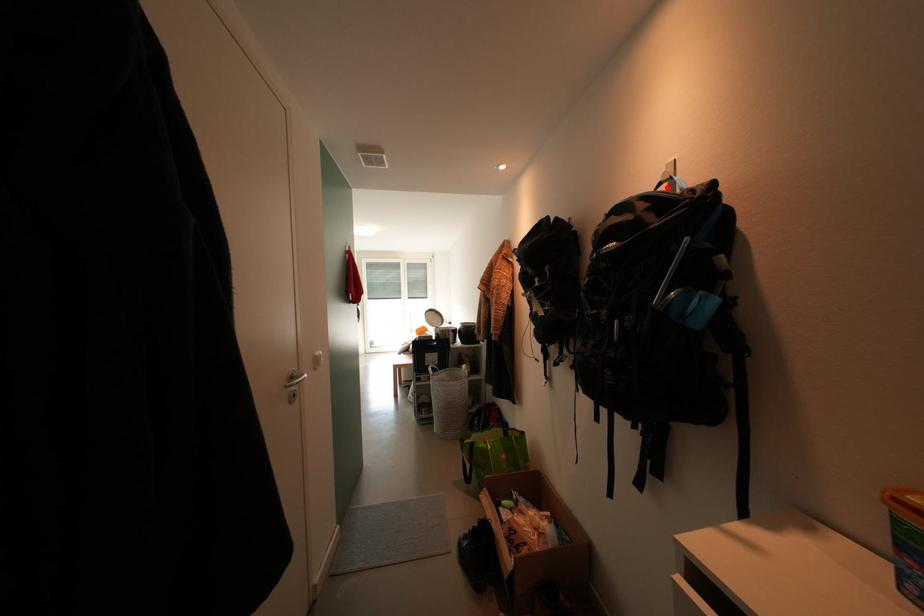
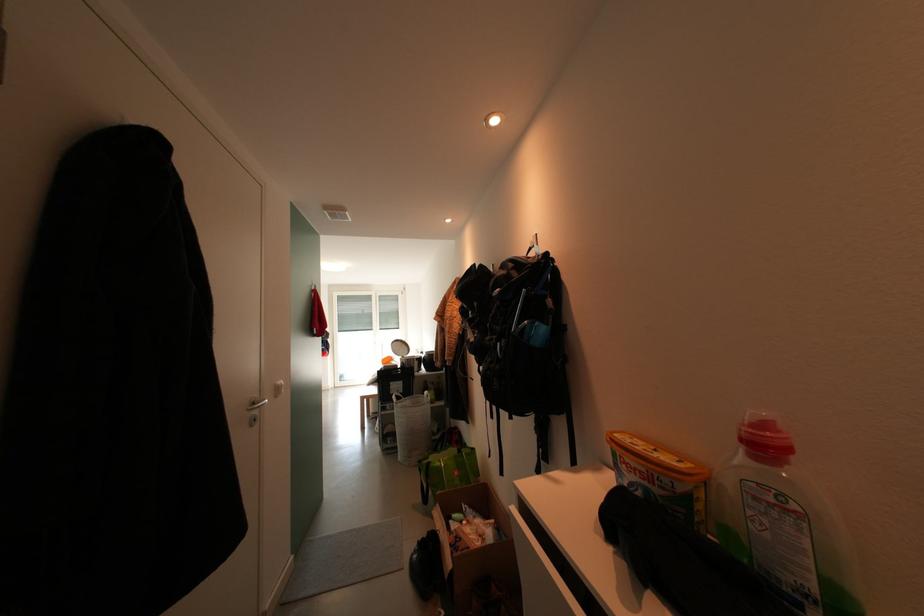
In the second image, find the point that corresponds to the highlighted location in the first image.

(538, 253)